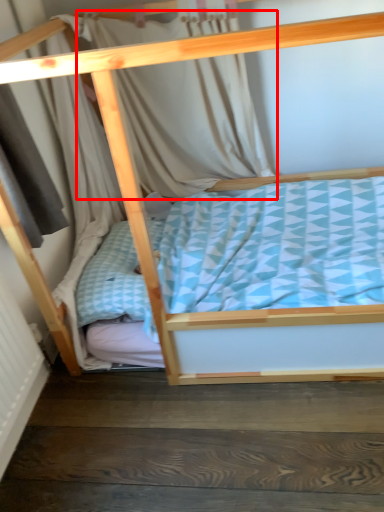
Question: From the image's perspective, what is the correct spatial positioning of curtain (annotated by the red box) in reference to stair?

Choices:
 (A) above
 (B) below

Answer: (A)